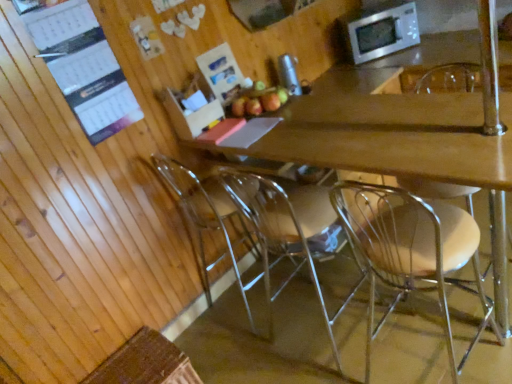
At what (x,y) coordinates should I click in order to perform the action: click on empty space that is in between clear plastic chair at center, the second chair in the right-to-left sequence, and clear acrylic chair at center, acting as the second chair starting from the left. Please return your answer as a coordinate pair (x, y). Looking at the image, I should click on (379, 338).